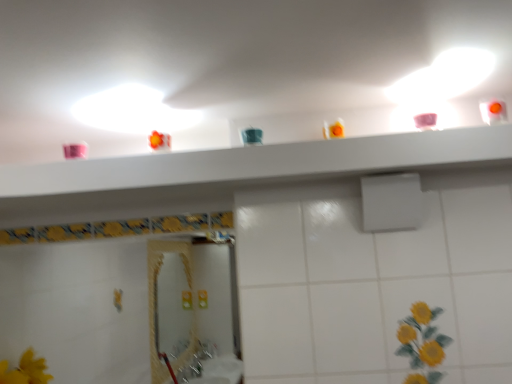
The width and height of the screenshot is (512, 384). Identify the location of white glossy shelf at upper center. pyautogui.click(x=261, y=162).

Describe the element at coordinates (261, 162) in the screenshot. I see `white glossy shelf at upper center` at that location.

The width and height of the screenshot is (512, 384). In order to click on white matte shower at center in this screenshot , I will do `click(391, 202)`.

Describe the element at coordinates (391, 202) in the screenshot. I see `white matte shower at center` at that location.

This screenshot has width=512, height=384. Identify the location of white glossy shelf at upper center. (261, 162).

Which object is positioned more to the left, white glossy shelf at upper center or white matte shower at center?

white glossy shelf at upper center is more to the left.

Considering their positions, is white glossy shelf at upper center located in front of or behind white matte shower at center?

white glossy shelf at upper center is positioned closer to the viewer than white matte shower at center.

Is point (67, 193) closer to viewer compared to point (406, 216)?

That is True.

From the image's perspective, is white glossy shelf at upper center beneath white matte shower at center?

Actually, white glossy shelf at upper center appears above white matte shower at center in the image.

From a real-world perspective, does white glossy shelf at upper center sit lower than white matte shower at center?

Actually, white glossy shelf at upper center is physically above white matte shower at center in the real world.

Is white glossy shelf at upper center wider or thinner than white matte shower at center?

Considering their sizes, white glossy shelf at upper center looks broader than white matte shower at center.

Considering the sizes of objects white glossy shelf at upper center and white matte shower at center in the image provided, who is shorter, white glossy shelf at upper center or white matte shower at center?

white glossy shelf at upper center is shorter.

Considering the relative sizes of white glossy shelf at upper center and white matte shower at center in the image provided, is white glossy shelf at upper center bigger than white matte shower at center?

Yes, white glossy shelf at upper center is bigger than white matte shower at center.

Based on the photo, is white matte shower at center located within white glossy shelf at upper center?

No, white matte shower at center is not surrounded by white glossy shelf at upper center.

Is white glossy shelf at upper center far from white matte shower at center?

They are positioned close to each other.

From the picture: Could you tell me if white glossy shelf at upper center is facing white matte shower at center?

No, white glossy shelf at upper center is not aimed at white matte shower at center.

Locate an element on the screen. The height and width of the screenshot is (384, 512). shelve that is in front of the white matte shower at center is located at coordinates point(261,162).

Considering the relative positions of white matte shower at center and white glossy shelf at upper center in the image provided, is white matte shower at center to the left or to the right of white glossy shelf at upper center?

white matte shower at center is to the right of white glossy shelf at upper center.

Between white matte shower at center and white glossy shelf at upper center, which one is positioned in front?

Positioned in front is white glossy shelf at upper center.

Which is behind, point (383, 186) or point (231, 175)?

The point (383, 186) is farther.

From the image's perspective, which object appears higher, white matte shower at center or white glossy shelf at upper center?

white glossy shelf at upper center, from the image's perspective.

From a real-world perspective, does white matte shower at center sit lower than white glossy shelf at upper center?

Correct, in the physical world, white matte shower at center is lower than white glossy shelf at upper center.

Which object is thinner, white matte shower at center or white glossy shelf at upper center?

white matte shower at center is thinner.

Who is shorter, white matte shower at center or white glossy shelf at upper center?

white glossy shelf at upper center.

Is white matte shower at center smaller than white glossy shelf at upper center?

Indeed, white matte shower at center has a smaller size compared to white glossy shelf at upper center.

Is white matte shower at center spatially inside white glossy shelf at upper center, or outside of it?

white matte shower at center is located beyond the bounds of white glossy shelf at upper center.

From the picture: Is white matte shower at center next to white glossy shelf at upper center?

white matte shower at center and white glossy shelf at upper center are not in contact.

Is white matte shower at center facing towards white glossy shelf at upper center?

No, white matte shower at center is not oriented towards white glossy shelf at upper center.

The image size is (512, 384). I want to click on shower that is below the white glossy shelf at upper center (from the image's perspective), so click(x=391, y=202).

Identify the location of shower below the white glossy shelf at upper center (from a real-world perspective). The width and height of the screenshot is (512, 384). (391, 202).

In the image, there is a white matte shower at center. Where is `shelve above it (from the image's perspective)`? shelve above it (from the image's perspective) is located at coordinates (261, 162).